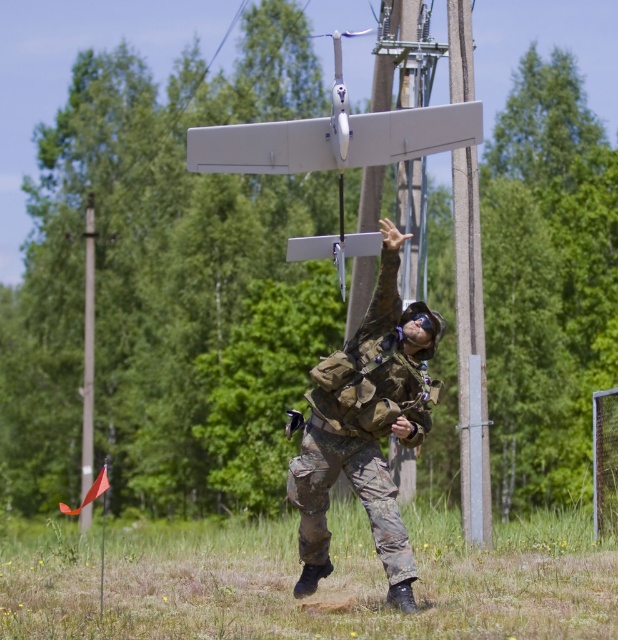
From the picture: You are a photographer trying to capture a photo of the camouflage fabric uniform at center and the smooth gray telegraph pole at center. Which object should you focus on first if you want to ensure both are in frame without moving the camera?

The camouflage fabric uniform at center is shorter than the smooth gray telegraph pole at center, so focusing on the uniform first would allow you to frame both objects within the camera view.

Looking at this image, you are a photographer trying to capture a clear image of both the camouflage fabric uniform at center and the smooth gray telegraph pole at center. Based on their sizes, which object should you focus on first to ensure it appears sharp in the photo?

The camouflage fabric uniform at center is smaller than the smooth gray telegraph pole at center, so you should focus on the smooth gray telegraph pole at center first because it is larger and easier to capture sharply.